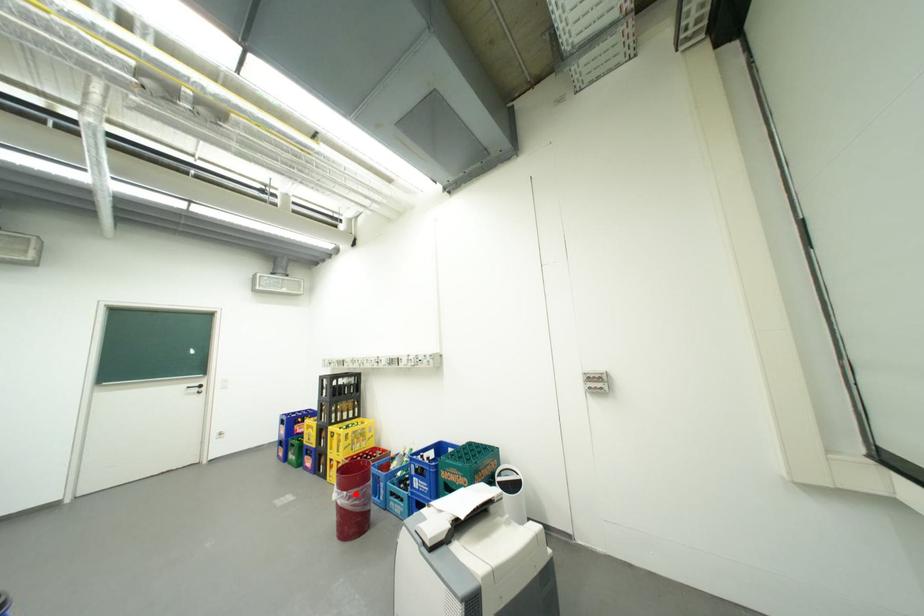
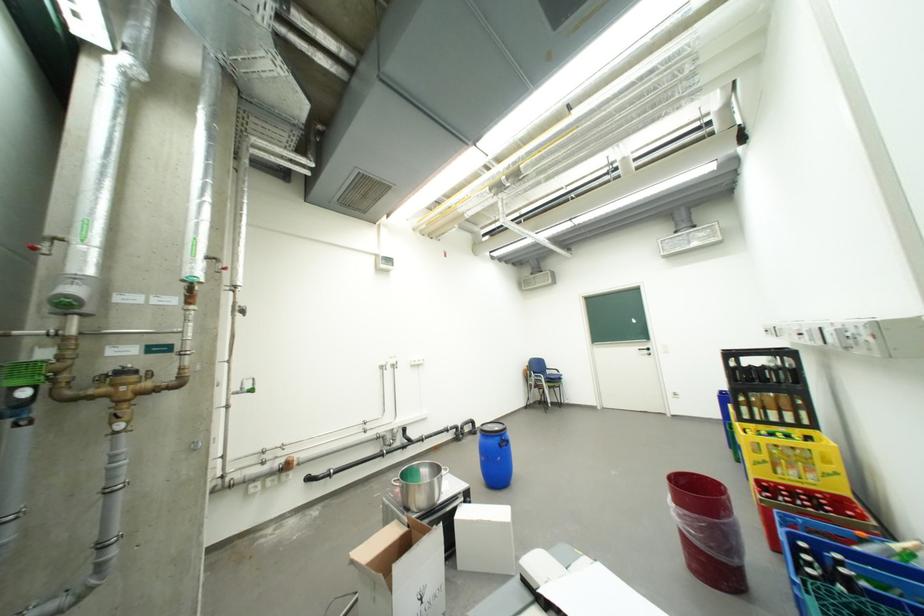
Question: I am providing you with two images of the same scene from different viewpoints. Image1 has a red point marked. In image2, the corresponding 3D location appears at what relative position? Reply with the corresponding letter.

Choices:
 (A) Closer
 (B) Farther

Answer: (A)